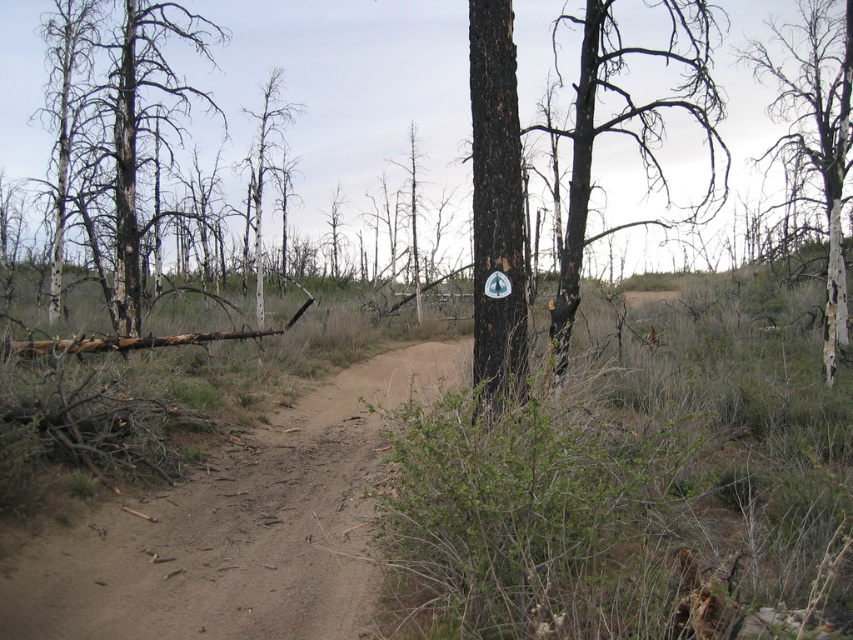
Can you confirm if black bark tree at center is shorter than charred wood tree at left?

Correct, black bark tree at center is not as tall as charred wood tree at left.

Is point (492, 132) positioned before point (129, 88)?

Yes, it is.

Where is `black bark tree at center`? This screenshot has width=853, height=640. black bark tree at center is located at coordinates (496, 209).

Image resolution: width=853 pixels, height=640 pixels. I want to click on black bark tree at center, so click(496, 209).

Can you confirm if black bark tree at center is positioned to the left of black charred tree at center?

Indeed, black bark tree at center is positioned on the left side of black charred tree at center.

I want to click on black bark tree at center, so click(496, 209).

Can you confirm if dirt path at center is thinner than charred wood tree at left?

Indeed, dirt path at center has a lesser width compared to charred wood tree at left.

Locate an element on the screen. The height and width of the screenshot is (640, 853). dirt path at center is located at coordinates (236, 529).